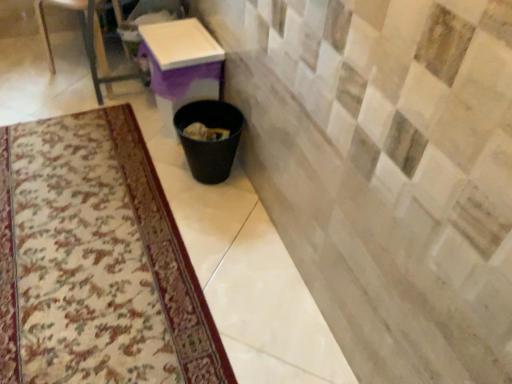
The image size is (512, 384). Identify the location of free space above carpeted mat at lower left (from a real-world perspective). (90, 224).